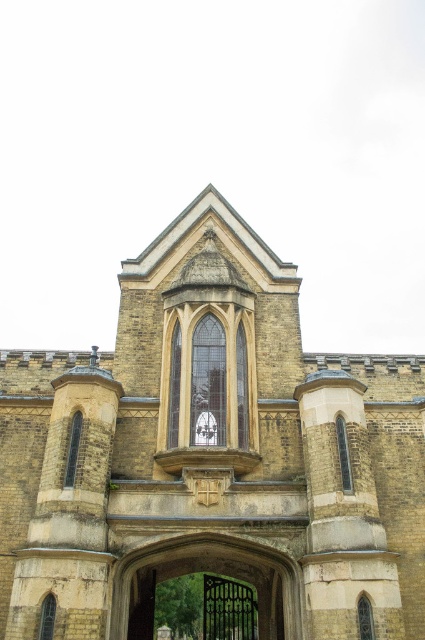
You are standing in front of a historic building and notice a point marked at coordinates [210,456]. What is located at this point?

The point at coordinates [210,456] is occupied by the yellow stone church at center.

You are standing in front of the historic building and want to enter through the entrance. Which object should you approach first, the yellow stone church at center or the black wrought iron gate at center?

The black wrought iron gate at center is the entrance, so you should approach the black wrought iron gate at center first before entering the yellow stone church at center.

You are a delivery person trying to enter the yellow stone church at center. The delivery truck is 3 meters wide. There is a black wrought iron gate at center. Can the truck pass through the gate? Please explain your reasoning.

The yellow stone church at center and black wrought iron gate at center are 7.92 meters apart. Since the distance between them is greater than the truck width of 3 meters, the truck can pass through the gate.